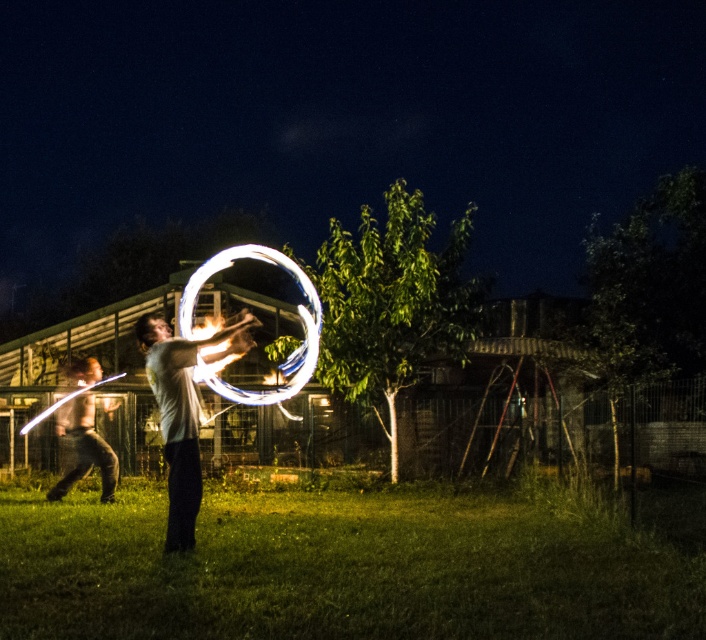
Question: Which of the following is the farthest from the observer?

Choices:
 (A) green grass at center
 (B) white glowing ring at center

Answer: (B)

Question: Which of the following is the closest to the observer?

Choices:
 (A) (61, 483)
 (B) (313, 292)

Answer: (A)

Question: Is green grass at center smaller than white glowing ring at center?

Choices:
 (A) yes
 (B) no

Answer: (A)

Question: Is green grass at center wider than white glowing ring at center?

Choices:
 (A) no
 (B) yes

Answer: (B)

Question: Considering the relative positions of green grass at center and white glossy hula hoop at center in the image provided, where is green grass at center located with respect to white glossy hula hoop at center?

Choices:
 (A) left
 (B) right

Answer: (B)

Question: Which point is farther from the camera taking this photo?

Choices:
 (A) (102, 493)
 (B) (186, 284)
 (C) (59, 541)

Answer: (B)